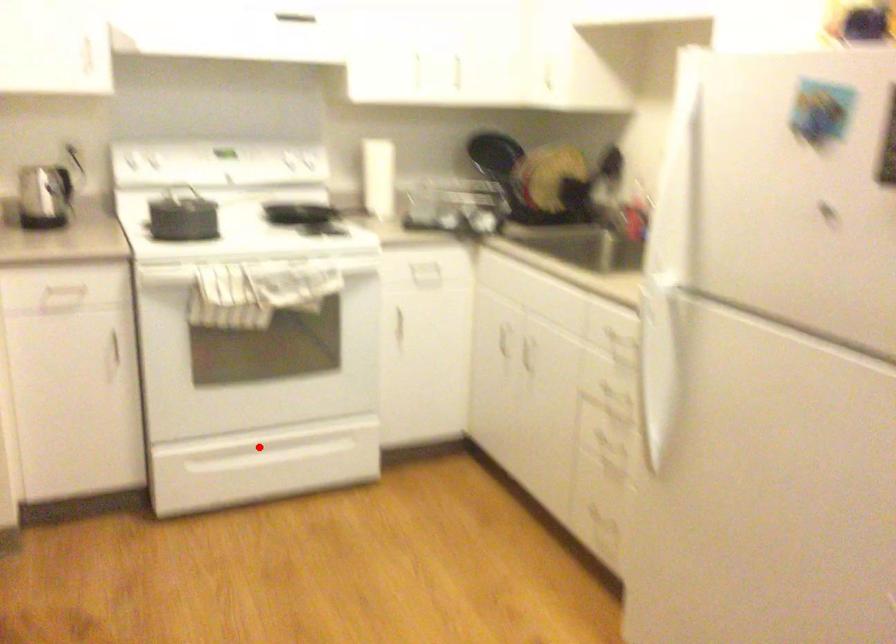
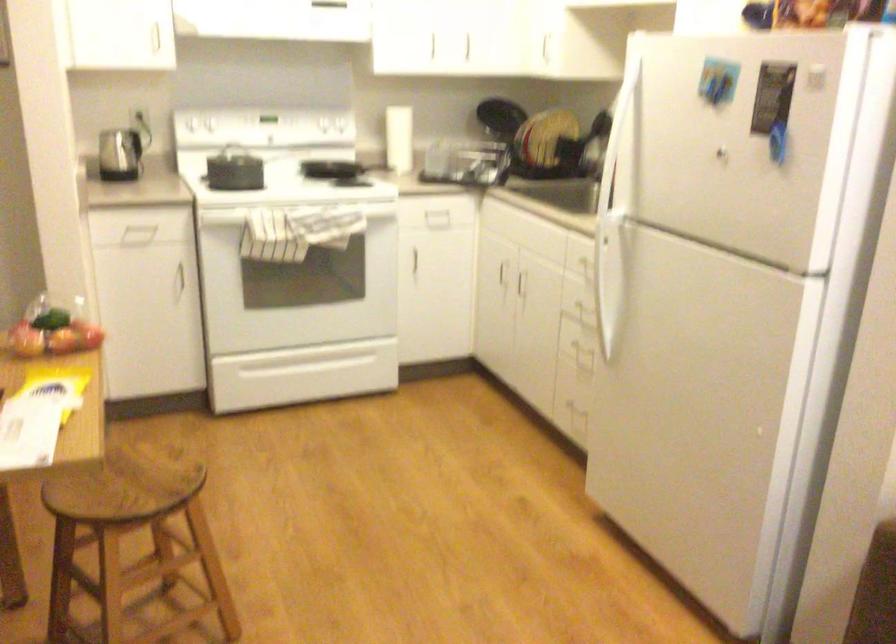
Question: A red point is marked in image1. In image2, is the corresponding 3D point closer to the camera or farther? Reply with the corresponding letter.

Choices:
 (A) The corresponding 3D point is closer.
 (B) The corresponding 3D point is farther.

Answer: (B)